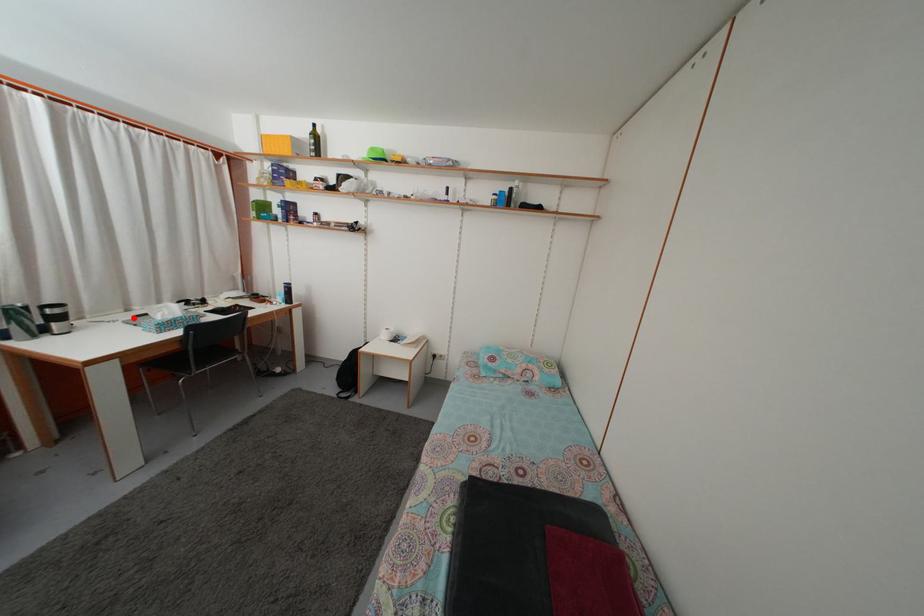
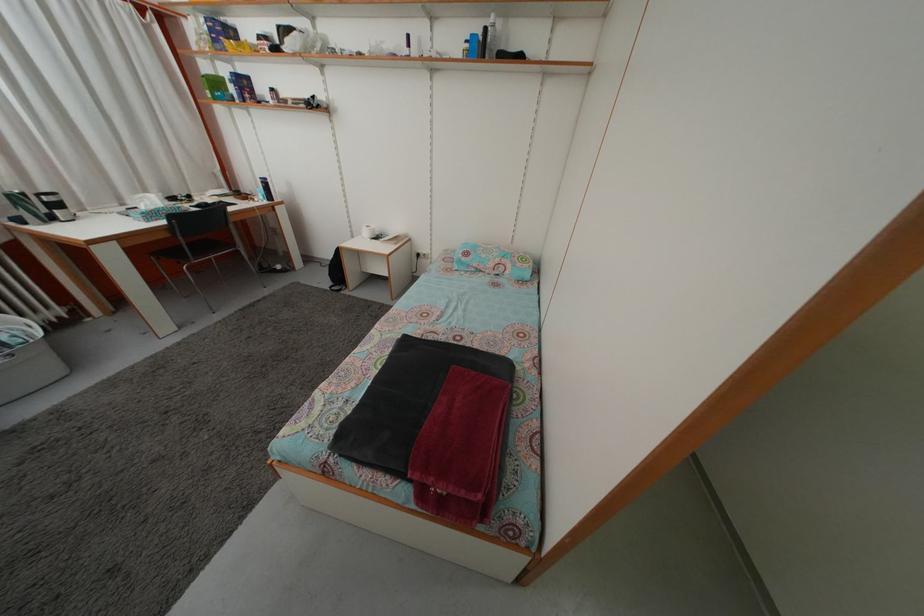
Question: I am providing you with two images of the same scene from different viewpoints. In image1, a red point is highlighted. Considering the same 3D point in image2, which of the following is correct?

Choices:
 (A) It is closer
 (B) It is farther

Answer: (B)